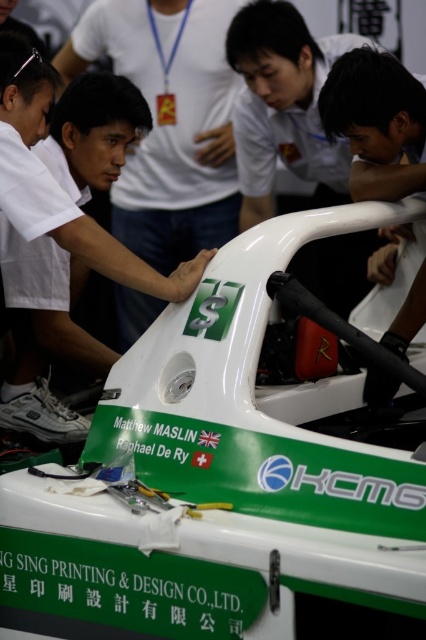
Is white glossy car at center below matte white helmet at center?

Indeed, white glossy car at center is positioned under matte white helmet at center.

Does point (103, 570) come farther from viewer compared to point (60, 268)?

No, (103, 570) is closer to viewer.

Where is `white glossy car at center`? The height and width of the screenshot is (640, 426). white glossy car at center is located at coordinates (227, 474).

Can you confirm if white glossy car at center is positioned above matte white shirt at center?

No, white glossy car at center is not above matte white shirt at center.

Describe the element at coordinates (227, 474) in the screenshot. I see `white glossy car at center` at that location.

You are a GUI agent. You are given a task and a screenshot of the screen. Output one action in this format:
    pyautogui.click(x=<x>, y=<y>)
    Task: Click on the white glossy car at center
    Image resolution: width=426 pixels, height=640 pixels.
    Given the screenshot: What is the action you would take?
    pyautogui.click(x=227, y=474)

Which is in front, point (175, 77) or point (46, 147)?

Positioned in front is point (46, 147).

Which is behind, point (215, 40) or point (55, 428)?

The point (215, 40) is behind.

Locate an element on the screen. The image size is (426, 640). matte white shirt at center is located at coordinates (169, 122).